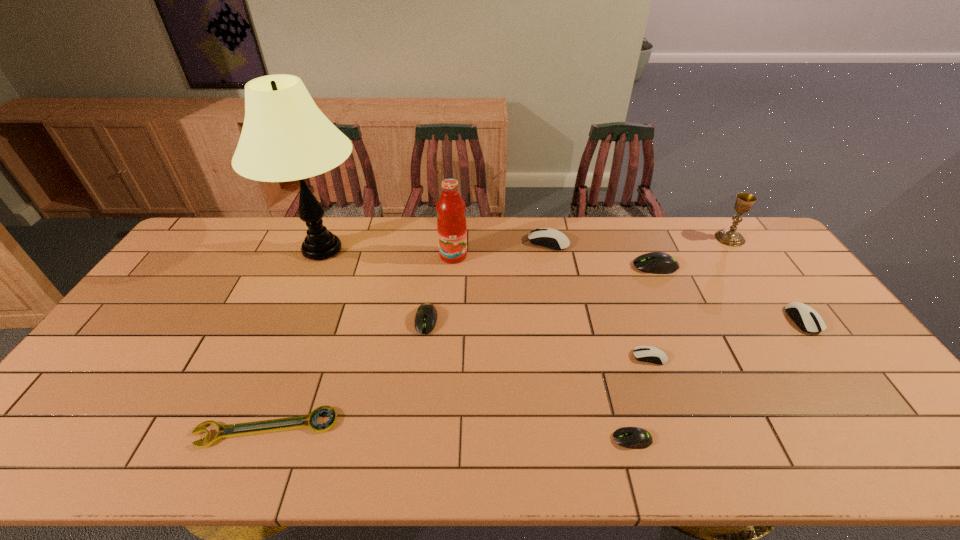
Identify the location of the rightmost computer mouse. (806, 318).

Image resolution: width=960 pixels, height=540 pixels. I want to click on the leftmost computer mouse, so click(x=426, y=316).

Where is `the leftmost gray computer mouse`? The width and height of the screenshot is (960, 540). the leftmost gray computer mouse is located at coordinates (426, 316).

Find the location of `the nearest white mouse`. the nearest white mouse is located at coordinates (644, 353).

What are the coordinates of `the fifth farthest computer mouse` in the screenshot? It's located at (644, 353).

Locate an element on the screen. The image size is (960, 540). the nearest computer mouse is located at coordinates (629, 437).

At what (x,y) coordinates should I click in order to perform the action: click on the nearest gray computer mouse. Please return your answer as a coordinate pair (x, y). This screenshot has width=960, height=540. Looking at the image, I should click on (629, 437).

What are the coordinates of `wrench` in the screenshot? It's located at (325, 427).

Locate an element on the screen. The height and width of the screenshot is (540, 960). vacant space situated 0.060m on the right of the tallest object is located at coordinates (388, 249).

Image resolution: width=960 pixels, height=540 pixels. In order to click on free space located 0.350m on the front label of the fruit juice in this screenshot , I will do `click(447, 347)`.